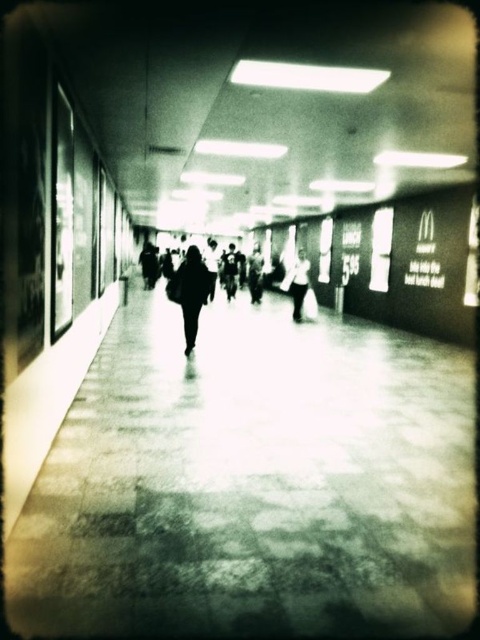
Which is in front, point (192, 344) or point (305, 280)?

Positioned in front is point (192, 344).

Is dark fabric jacket at center in front of white cotton shirt at center?

That is True.

The image size is (480, 640). Identify the location of dark fabric jacket at center. click(190, 292).

You are a GUI agent. You are given a task and a screenshot of the screen. Output one action in this format:
    pyautogui.click(x=<x>, y=<y>)
    Task: Click on the dark fabric jacket at center
    This screenshot has width=480, height=640.
    Given the screenshot: What is the action you would take?
    pyautogui.click(x=190, y=292)